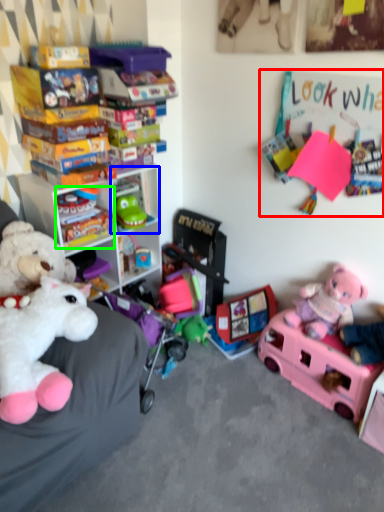
Question: Based on their relative distances, which object is farther from bulletin board (highlighted by a red box)? Choose from shelf (highlighted by a blue box) and toy (highlighted by a green box).

Choices:
 (A) shelf
 (B) toy

Answer: (B)